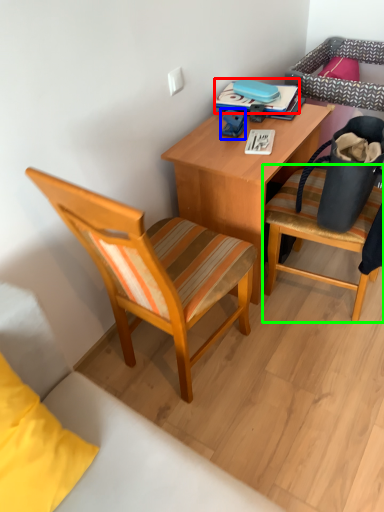
Question: Estimate the real-world distances between objects in this image. Which object is farther from book (highlighted by a red box), toy (highlighted by a blue box) or chair (highlighted by a green box)?

Choices:
 (A) toy
 (B) chair

Answer: (B)